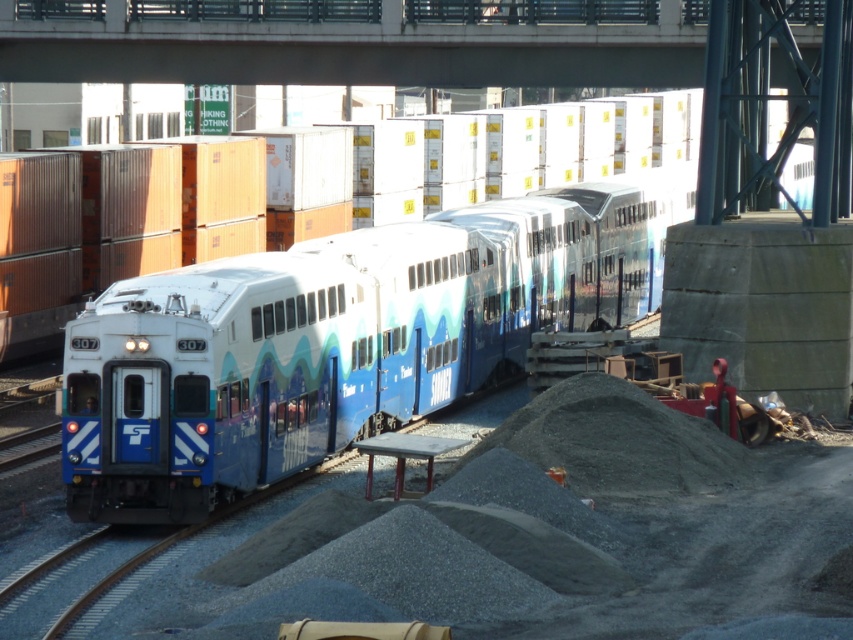
Which is more to the left, blue glossy train at center or concrete at upper center?

concrete at upper center

Can you confirm if blue glossy train at center is shorter than concrete at upper center?

No.

Describe the element at coordinates (329, 342) in the screenshot. I see `blue glossy train at center` at that location.

I want to click on blue glossy train at center, so click(329, 342).